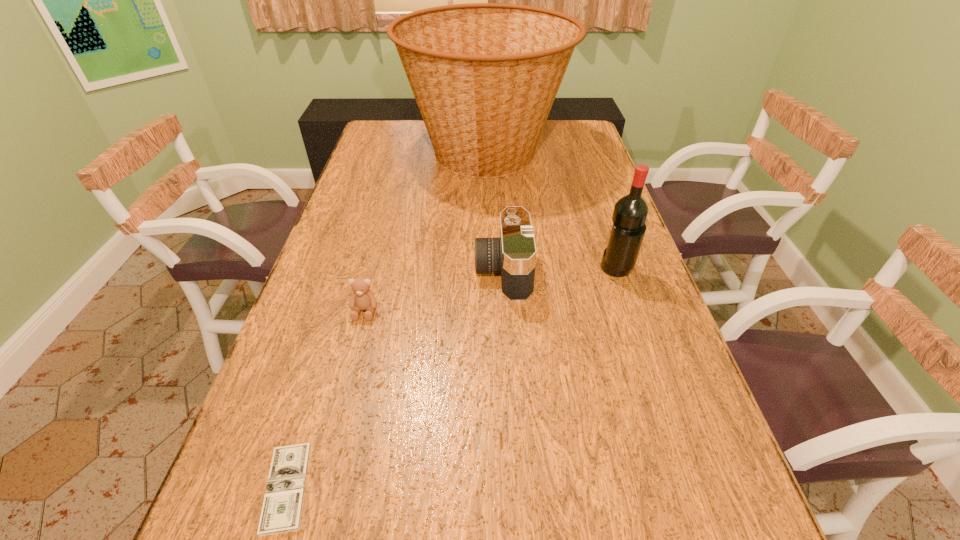
This screenshot has width=960, height=540. Identify the location of object located at the far left corner. (484, 75).

Find the location of a particular element. The width and height of the screenshot is (960, 540). object present at the far right corner is located at coordinates (484, 75).

Identify the location of vacant region at the far edge. The width and height of the screenshot is (960, 540). (548, 147).

In the image, there is a desktop. In order to click on vacant space at the left edge in this screenshot , I will do `click(308, 319)`.

I want to click on vacant space at the right edge of the desktop, so click(597, 182).

At what (x,y) coordinates should I click in order to perform the action: click on empty space that is in between the shortest object and the camera. Please return your answer as a coordinate pair (x, y). This screenshot has width=960, height=540. Looking at the image, I should click on (395, 379).

Locate an element on the screen. empty space between the camera and the wine bottle is located at coordinates (560, 271).

You are a GUI agent. You are given a task and a screenshot of the screen. Output one action in this format:
    pyautogui.click(x=<x>, y=<y>)
    Task: Click on the empty space between the second shortest object and the third tallest object
    Image resolution: width=960 pixels, height=540 pixels.
    Given the screenshot: What is the action you would take?
    pyautogui.click(x=434, y=291)

Locate an element on the screen. blank region between the third tallest object and the nearest object is located at coordinates (395, 379).

What are the coordinates of `free spot between the wine bottle and the farthest object` in the screenshot? It's located at (551, 212).